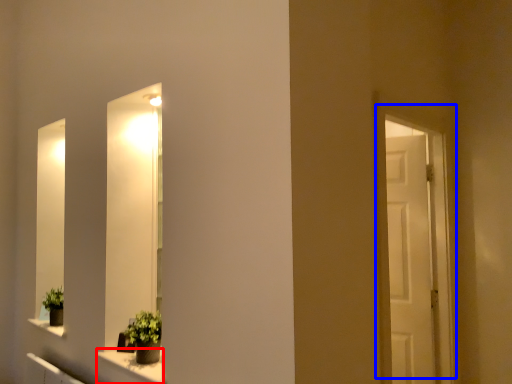
Question: Which of the following is the farthest to the observer, window sill (highlighted by a red box) or door (highlighted by a blue box)?

Choices:
 (A) window sill
 (B) door

Answer: (B)